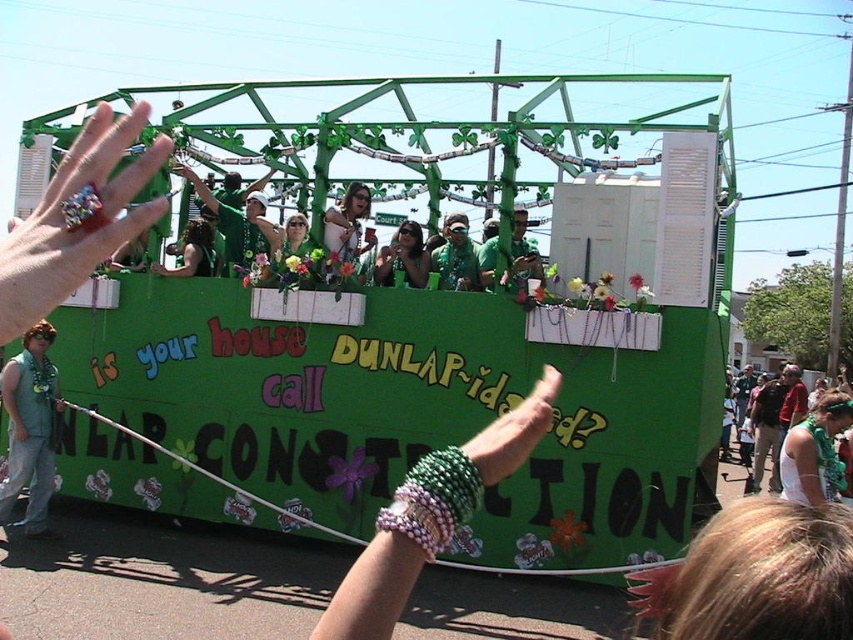
Question: Is shiny silver sunglasses at center bigger than shiny green shirt at center?

Choices:
 (A) yes
 (B) no

Answer: (A)

Question: Estimate the real-world distances between objects in this image. Which object is farther from the shiny green shirt at center?

Choices:
 (A) green fabric vest at left
 (B) shiny silver sunglasses at center

Answer: (A)

Question: Can you confirm if green fabric vest at left is smaller than shiny silver sunglasses at center?

Choices:
 (A) no
 (B) yes

Answer: (B)

Question: Which object is positioned closest to the shiny green shirt at center?

Choices:
 (A) green fabric headband at upper right
 (B) green fabric shirt at center

Answer: (B)

Question: Which of the following is the closest to the observer?

Choices:
 (A) (473, 276)
 (B) (514, 224)
 (C) (49, 419)
 (D) (352, 220)

Answer: (C)

Question: From the image, what is the correct spatial relationship of shiny green shirt at center in relation to matte green sunglasses at center?

Choices:
 (A) above
 (B) below

Answer: (A)